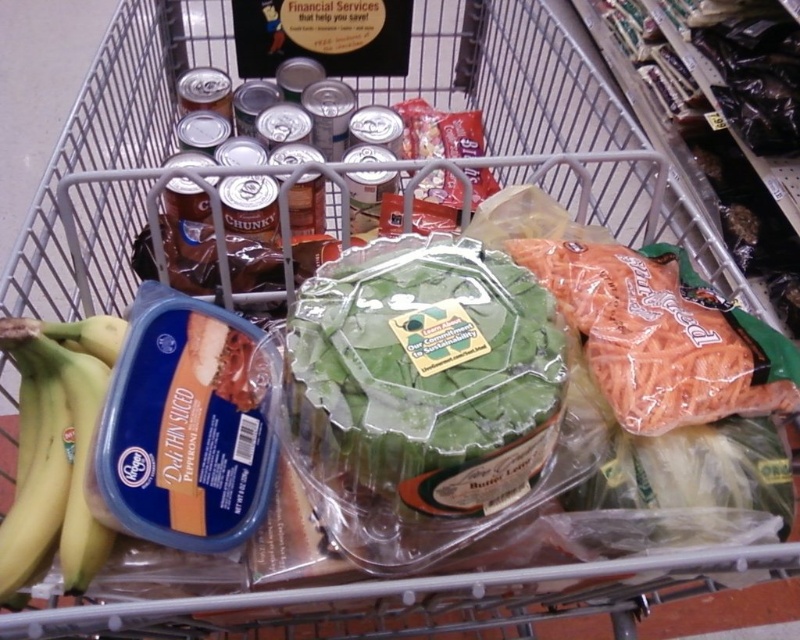
Question: Which object appears farthest from the camera in this image?

Choices:
 (A) green leafy lettuce at center
 (B) yellow matte bananas at left

Answer: (B)

Question: Is green leafy lettuce at center thinner than yellow matte bananas at left?

Choices:
 (A) yes
 (B) no

Answer: (B)

Question: Is green leafy lettuce at center thinner than yellow matte bananas at left?

Choices:
 (A) no
 (B) yes

Answer: (A)

Question: Which point is farther to the camera?

Choices:
 (A) (38, 513)
 (B) (490, 349)

Answer: (A)

Question: Can you confirm if green leafy lettuce at center is smaller than yellow matte bananas at left?

Choices:
 (A) yes
 (B) no

Answer: (B)